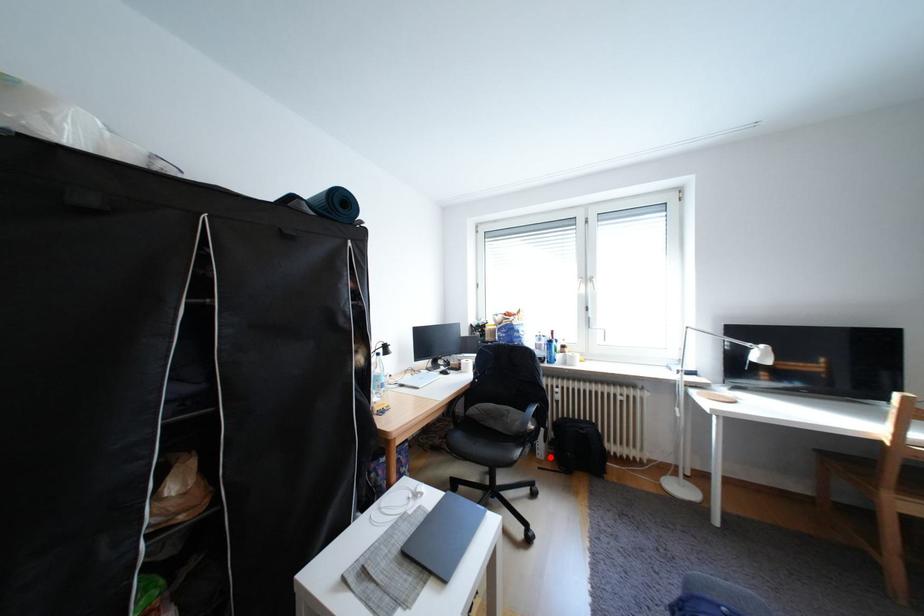
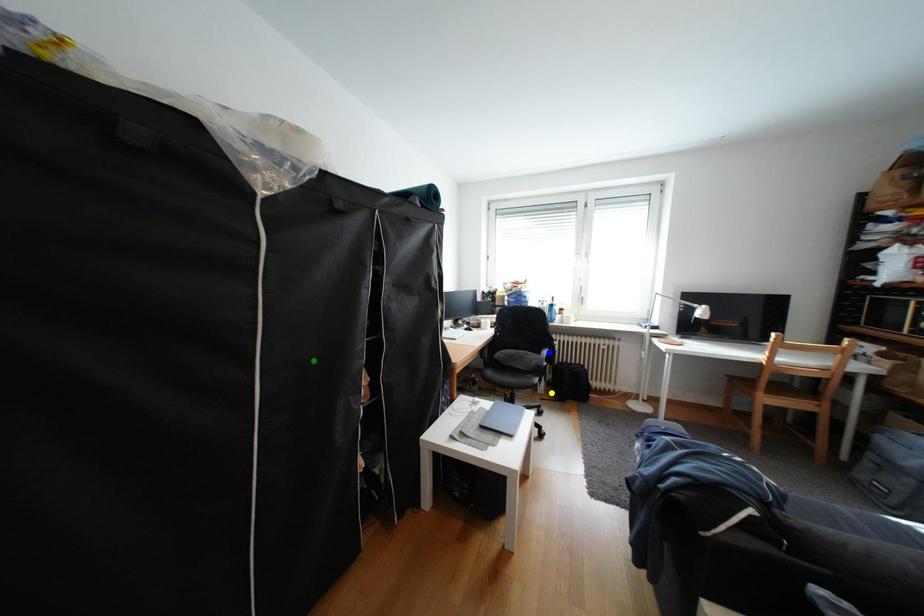
Question: I am providing you with two images of the same scene from different viewpoints. A red point is marked on the first image. You are given multiple points on the second image. Which spot in image 2 lines up with the point in image 1?

Choices:
 (A) blue point
 (B) green point
 (C) yellow point

Answer: (C)